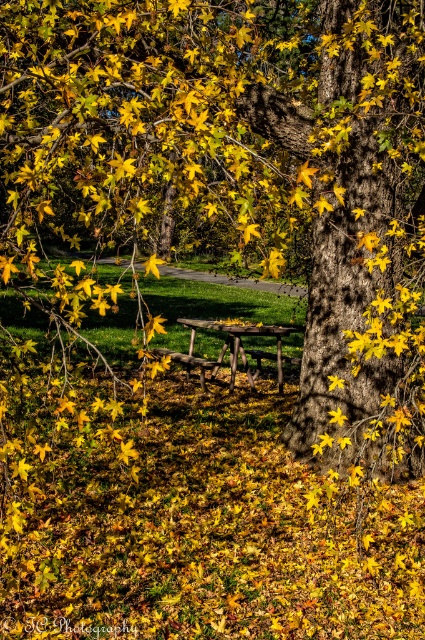
Question: Can you confirm if yellow-green leaves at center is bigger than wooden park bench at center?

Choices:
 (A) yes
 (B) no

Answer: (A)

Question: Among these points, which one is farthest from the camera?

Choices:
 (A) (x=159, y=348)
 (B) (x=371, y=132)

Answer: (A)

Question: Can you confirm if yellow-green leaves at center is positioned below wooden park bench at center?

Choices:
 (A) no
 (B) yes

Answer: (A)

Question: Observing the image, what is the correct spatial positioning of yellow-green leaves at center in reference to wooden park bench at center?

Choices:
 (A) left
 (B) right

Answer: (A)